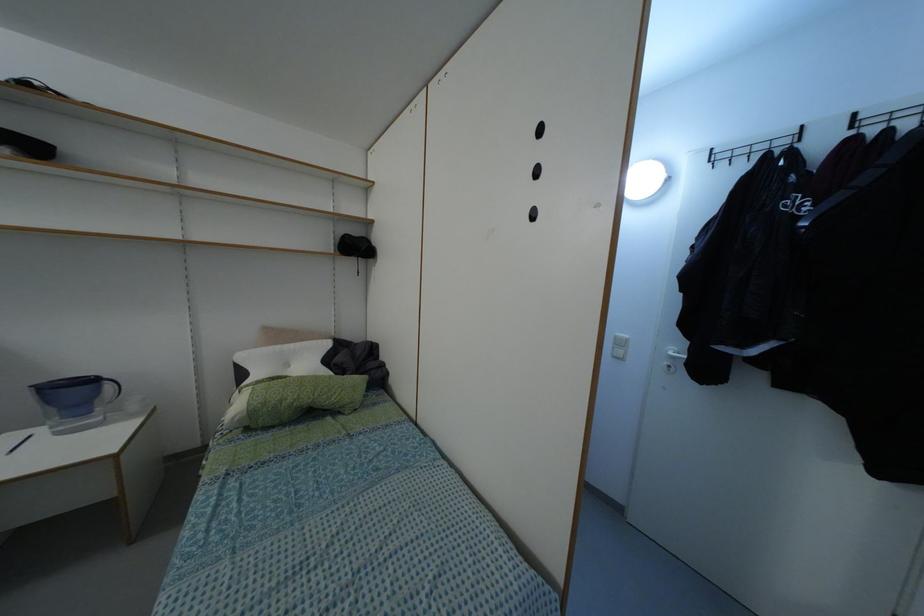
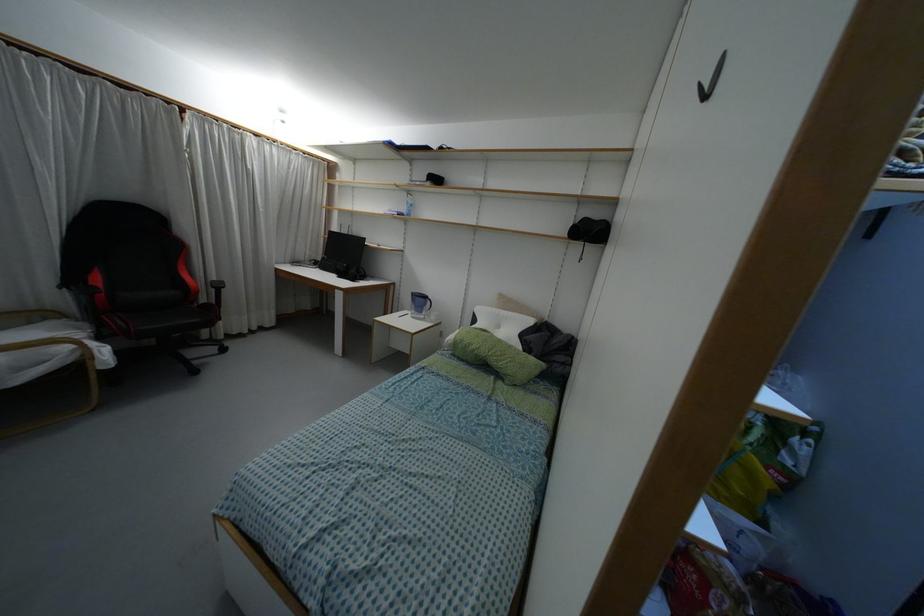
Where in the second image is the point corresponding to (248,405) from the first image?

(455, 337)